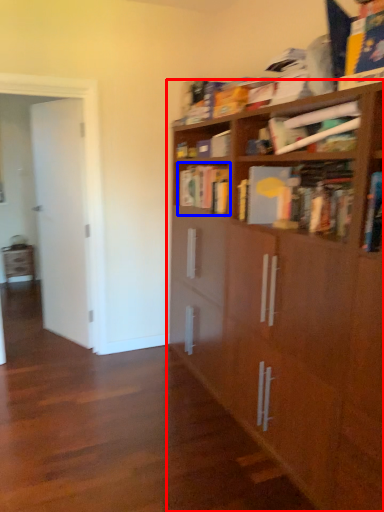
Question: Which object is further to the camera taking this photo, bookcase (highlighted by a red box) or book (highlighted by a blue box)?

Choices:
 (A) bookcase
 (B) book

Answer: (B)